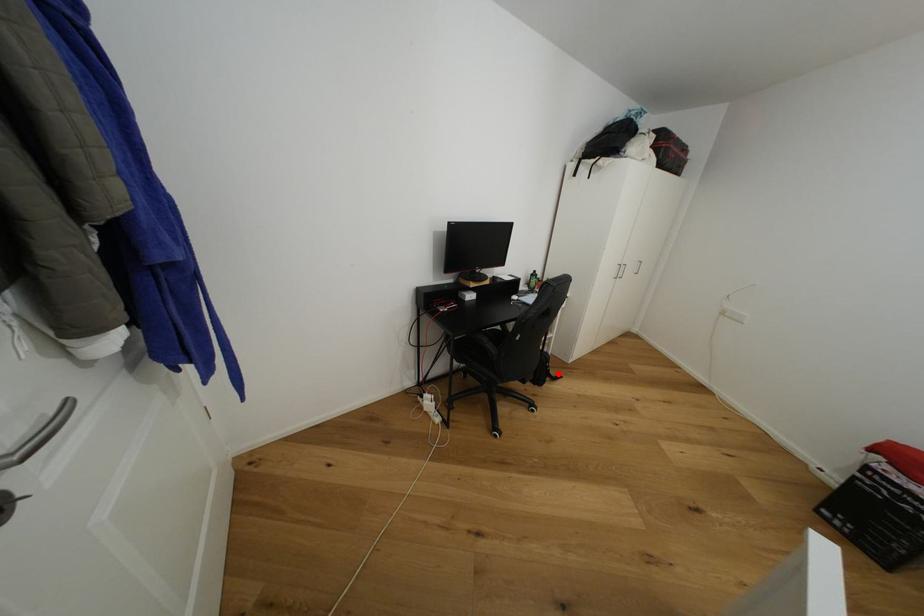
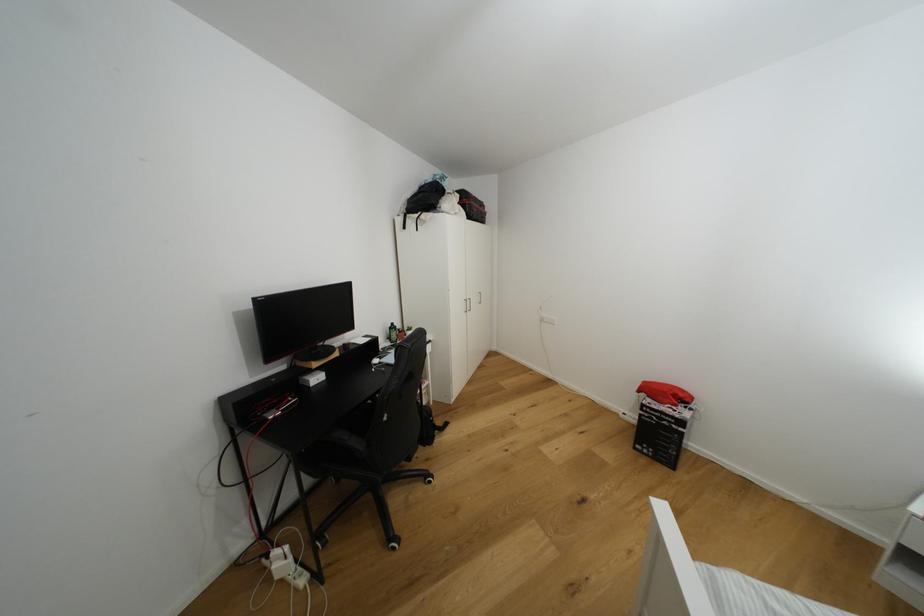
Question: A red point is marked in image1. In image2, is the corresponding 3D point closer to the camera or farther? Reply with the corresponding letter.

Choices:
 (A) The corresponding 3D point is closer.
 (B) The corresponding 3D point is farther.

Answer: (A)